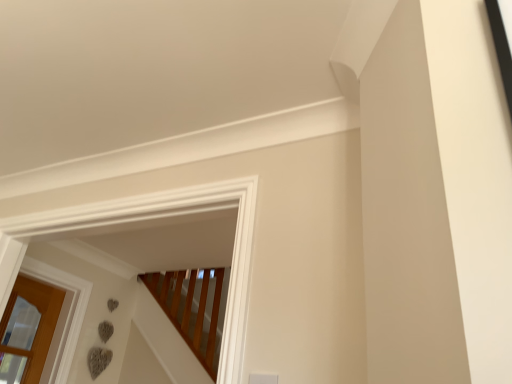
At what (x,y) coordinates should I click in order to perform the action: click on wooden door at left. Please return your answer as a coordinate pair (x, y). This screenshot has height=384, width=512. Looking at the image, I should click on (28, 330).

Describe the element at coordinates (28, 330) in the screenshot. I see `wooden door at left` at that location.

Find the location of a particular element. wooden door at left is located at coordinates (28, 330).